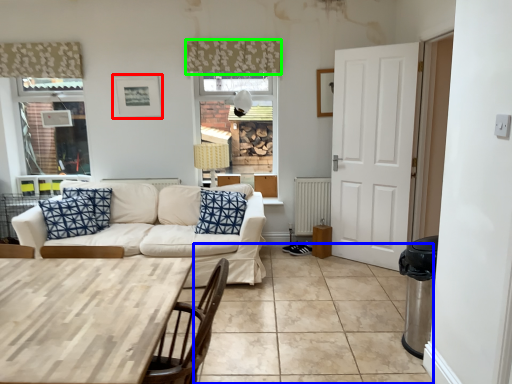
Question: Considering the real-world distances, which object is closest to picture frame (highlighted by a red box)? tile (highlighted by a blue box) or curtain (highlighted by a green box).

Choices:
 (A) tile
 (B) curtain

Answer: (B)